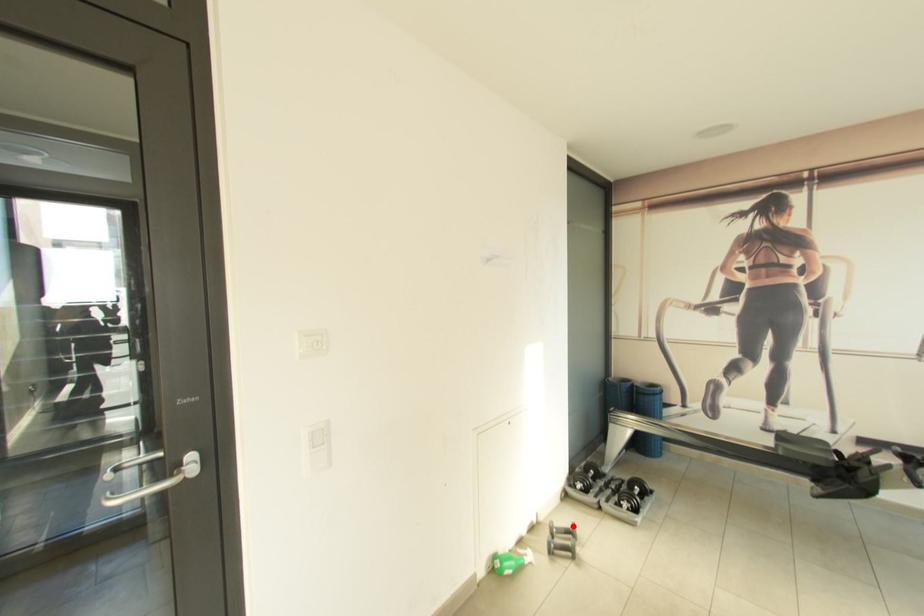
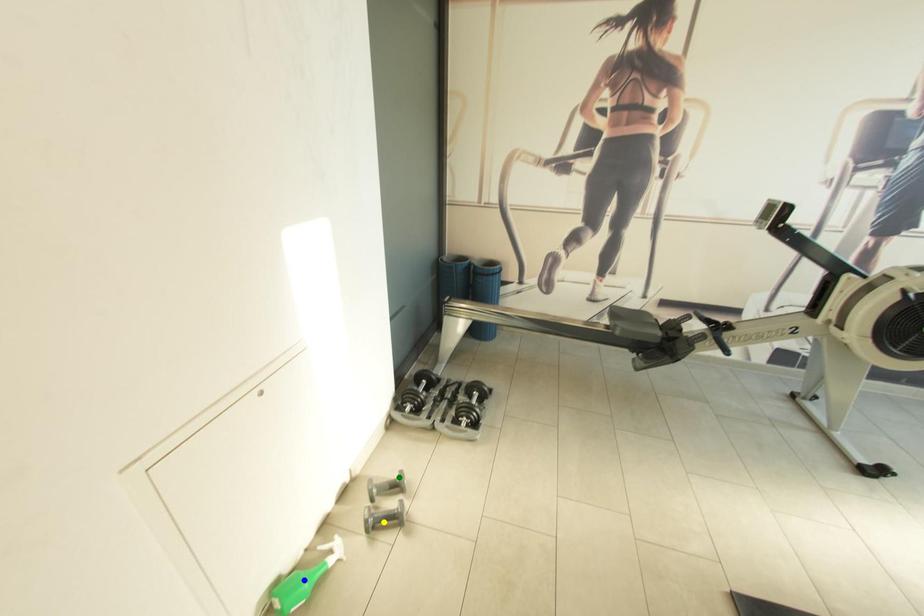
Question: I am providing you with two images of the same scene from different viewpoints. A red point is marked on the first image. You are given multiple points on the second image. Can you choose the point in image 2 that corresponds to the point in image 1?

Choices:
 (A) yellow point
 (B) blue point
 (C) green point

Answer: (C)